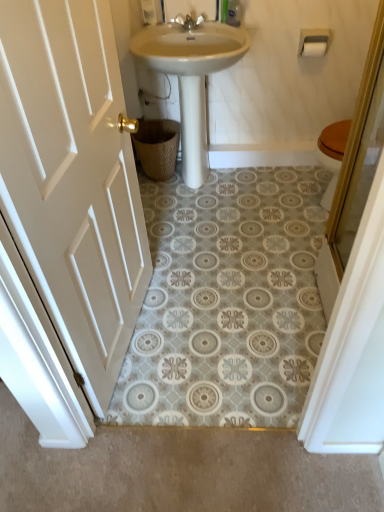
Question: Is silver metallic faucet at upper center smaller than white plastic toilet paper holder at upper right?

Choices:
 (A) no
 (B) yes

Answer: (B)

Question: Is silver metallic faucet at upper center placed right next to white plastic toilet paper holder at upper right?

Choices:
 (A) no
 (B) yes

Answer: (A)

Question: From a real-world perspective, is silver metallic faucet at upper center physically above white plastic toilet paper holder at upper right?

Choices:
 (A) no
 (B) yes

Answer: (B)

Question: Is silver metallic faucet at upper center oriented away from white plastic toilet paper holder at upper right?

Choices:
 (A) yes
 (B) no

Answer: (B)

Question: Considering the relative sizes of silver metallic faucet at upper center and white plastic toilet paper holder at upper right in the image provided, is silver metallic faucet at upper center bigger than white plastic toilet paper holder at upper right?

Choices:
 (A) no
 (B) yes

Answer: (A)

Question: Considering the positions of woven brown basket at lower center and white plastic toilet paper holder at upper right in the image, is woven brown basket at lower center wider or thinner than white plastic toilet paper holder at upper right?

Choices:
 (A) thin
 (B) wide

Answer: (B)

Question: Considering the positions of woven brown basket at lower center and white plastic toilet paper holder at upper right in the image, is woven brown basket at lower center taller or shorter than white plastic toilet paper holder at upper right?

Choices:
 (A) tall
 (B) short

Answer: (A)

Question: Would you say woven brown basket at lower center is to the left or to the right of white plastic toilet paper holder at upper right in the picture?

Choices:
 (A) left
 (B) right

Answer: (A)

Question: In terms of size, does woven brown basket at lower center appear bigger or smaller than white plastic toilet paper holder at upper right?

Choices:
 (A) big
 (B) small

Answer: (A)

Question: Is clear plastic bottle at upper center inside or outside of white wood door at left?

Choices:
 (A) outside
 (B) inside

Answer: (A)

Question: From their relative heights in the image, would you say clear plastic bottle at upper center is taller or shorter than white wood door at left?

Choices:
 (A) short
 (B) tall

Answer: (A)

Question: From the image's perspective, is clear plastic bottle at upper center above or below white wood door at left?

Choices:
 (A) below
 (B) above

Answer: (B)

Question: In terms of size, does clear plastic bottle at upper center appear bigger or smaller than white wood door at left?

Choices:
 (A) small
 (B) big

Answer: (A)

Question: Is silver metallic faucet at upper center inside or outside of white matte toilet paper at upper right?

Choices:
 (A) outside
 (B) inside

Answer: (A)

Question: From the image's perspective, relative to white matte toilet paper at upper right, is silver metallic faucet at upper center above or below?

Choices:
 (A) below
 (B) above

Answer: (B)